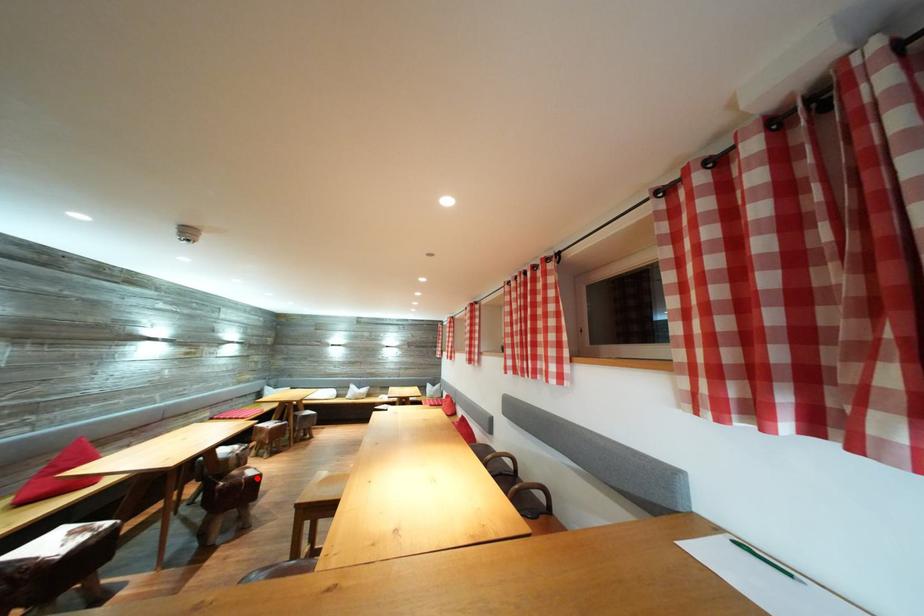
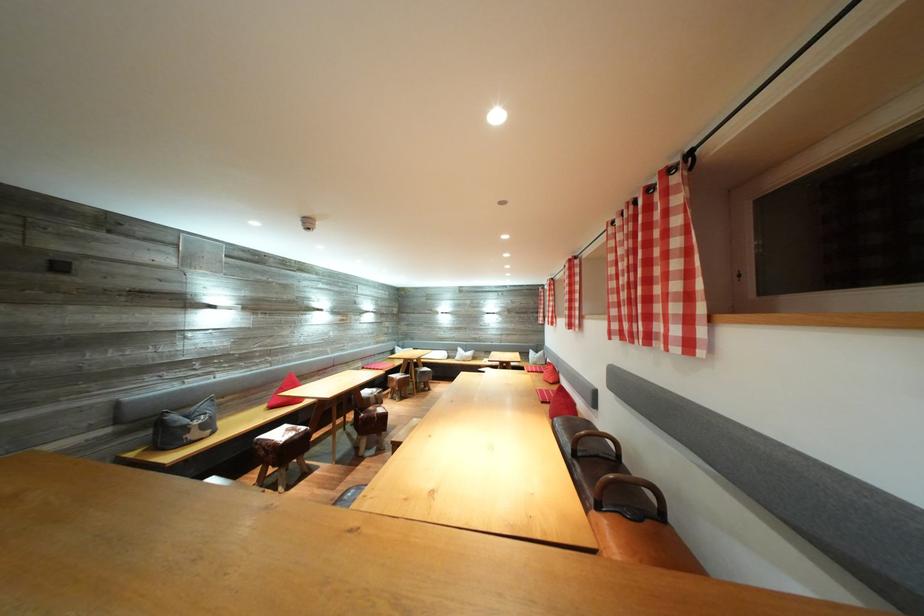
Question: I am providing you with two images of the same scene from different viewpoints. A red point is marked on the first image. Is the red point's position out of view in image 2?

Choices:
 (A) Yes
 (B) No

Answer: (B)